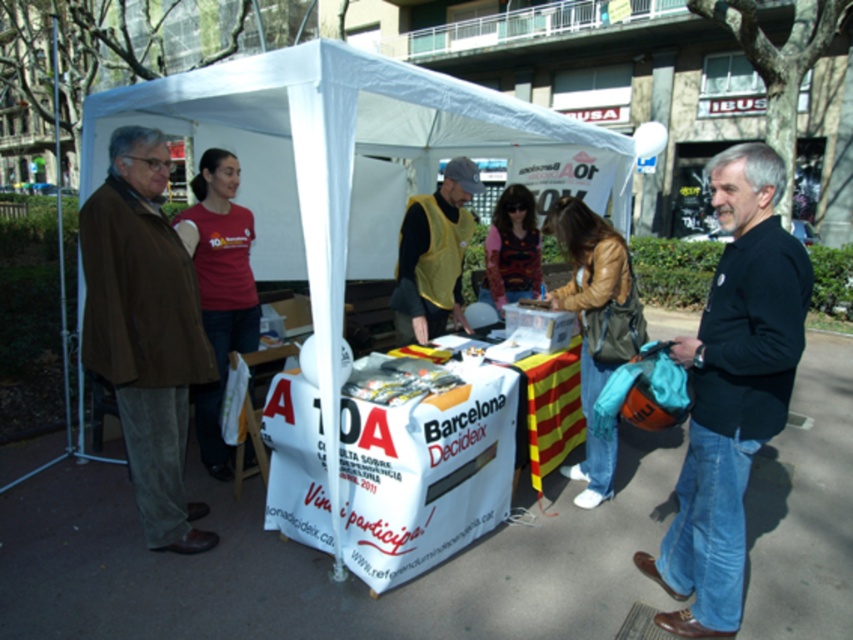
From the picture: Does brown corduroy jacket at left have a lesser height compared to yellow vest at center?

Incorrect, brown corduroy jacket at left's height does not fall short of yellow vest at center's.

Does brown corduroy jacket at left have a smaller size compared to yellow vest at center?

No, brown corduroy jacket at left is not smaller than yellow vest at center.

Measure the distance between brown corduroy jacket at left and camera.

brown corduroy jacket at left and camera are 3.22 meters apart.

The image size is (853, 640). In order to click on brown corduroy jacket at left in this screenshot , I will do `click(144, 330)`.

Who is taller, black matte shirt at right or brown corduroy jacket at left?

With more height is brown corduroy jacket at left.

Locate an element on the screen. The image size is (853, 640). black matte shirt at right is located at coordinates (732, 390).

Between white fabric canopy at center and brown corduroy jacket at left, which one is positioned higher?

brown corduroy jacket at left

Is white fabric canopy at center closer to camera compared to brown corduroy jacket at left?

Yes, white fabric canopy at center is closer to the viewer.

Locate an element on the screen. This screenshot has width=853, height=640. white fabric canopy at center is located at coordinates (347, 156).

Identify the location of white fabric canopy at center. This screenshot has width=853, height=640. pos(347,156).